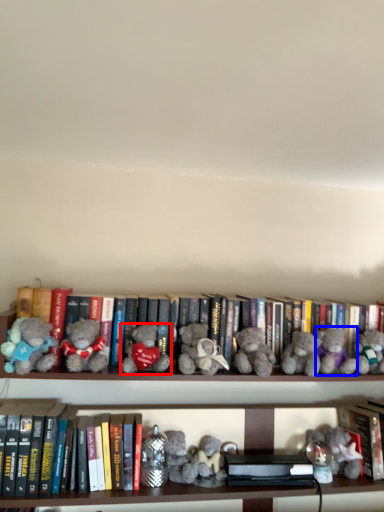
Question: Which object appears closest to the camera in this image, teddy bear (highlighted by a red box) or teddy bear (highlighted by a blue box)?

Choices:
 (A) teddy bear
 (B) teddy bear

Answer: (A)